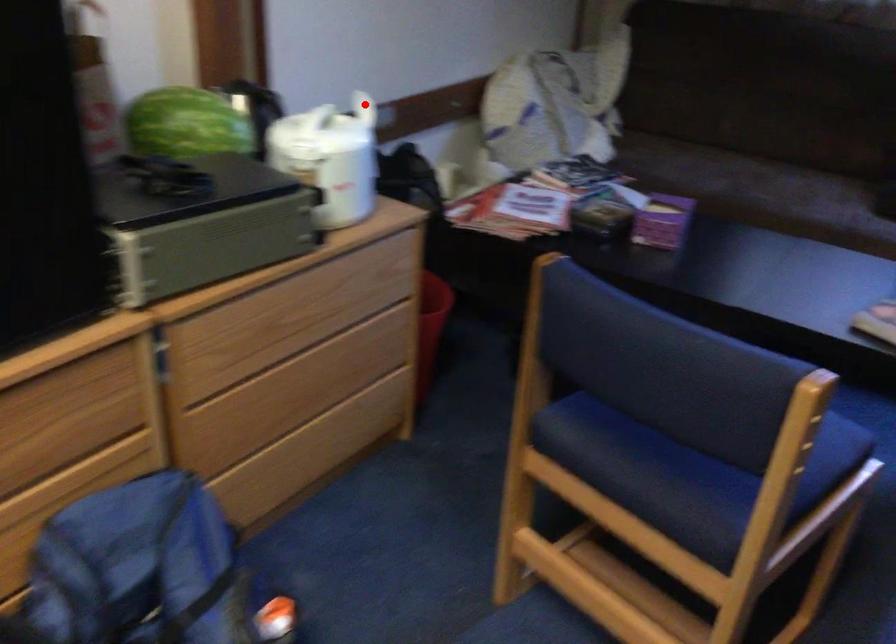
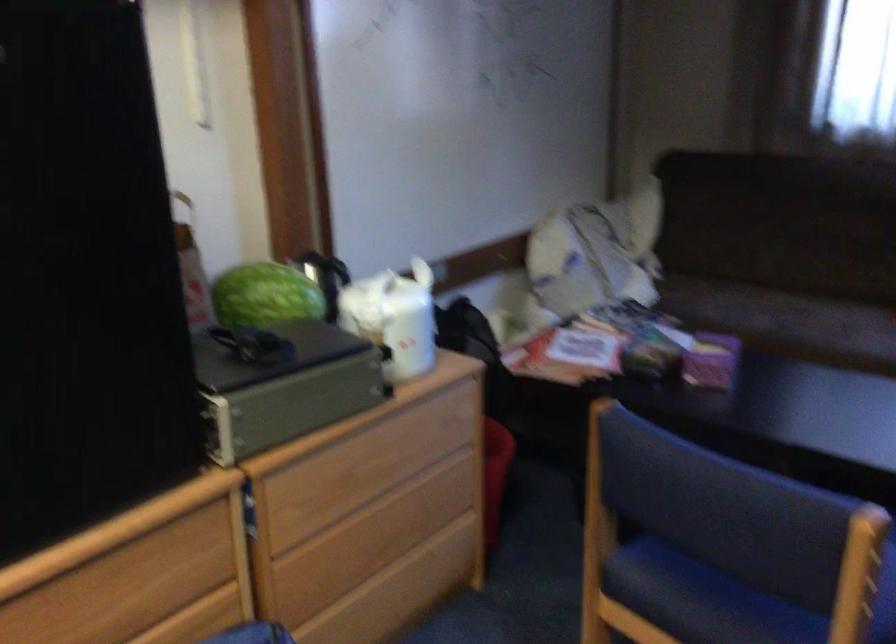
Question: I am providing you with two images of the same scene from different viewpoints. Image1 has a red point marked. In image2, the corresponding 3D location appears at what relative position? Reply with the corresponding letter.

Choices:
 (A) Closer
 (B) Farther

Answer: (B)